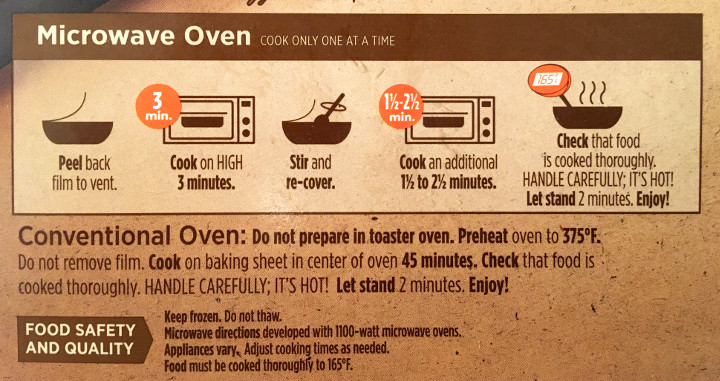
Find the location of a particular element. Image resolution: width=720 pixels, height=381 pixels. microwave oven is located at coordinates (225, 132).